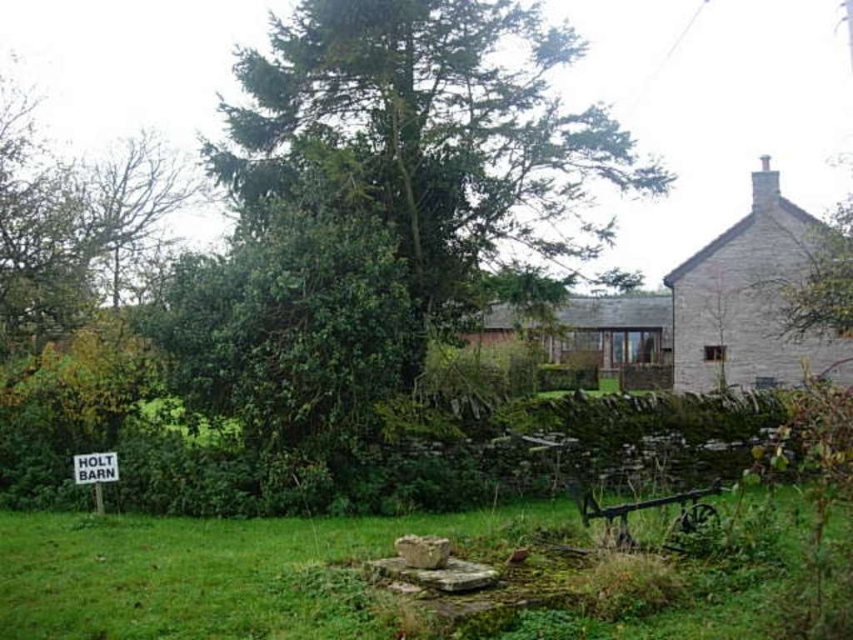
Between stone cottage at upper right and brown wooden cottage at center, which one appears on the left side from the viewer's perspective?

Positioned to the left is brown wooden cottage at center.

Does stone cottage at upper right appear on the right side of brown wooden cottage at center?

→ Indeed, stone cottage at upper right is positioned on the right side of brown wooden cottage at center.

Who is more distant from viewer, (x=741, y=337) or (x=643, y=346)?

The point (x=643, y=346) is more distant.

Where is `stone cottage at upper right`? The image size is (853, 640). stone cottage at upper right is located at coordinates (750, 300).

What do you see at coordinates (434, 136) in the screenshot?
I see `green leafy tree at center` at bounding box center [434, 136].

Is green leafy tree at center shorter than brown wooden cottage at center?

Indeed, green leafy tree at center has a lesser height compared to brown wooden cottage at center.

Locate an element on the screen. This screenshot has width=853, height=640. green leafy tree at center is located at coordinates tap(434, 136).

Can you confirm if stone cottage at upper right is thinner than white paper sign at lower left?

No.

Is stone cottage at upper right wider than white paper sign at lower left?

Correct, the width of stone cottage at upper right exceeds that of white paper sign at lower left.

Describe the element at coordinates (750, 300) in the screenshot. This screenshot has height=640, width=853. I see `stone cottage at upper right` at that location.

I want to click on stone cottage at upper right, so click(750, 300).